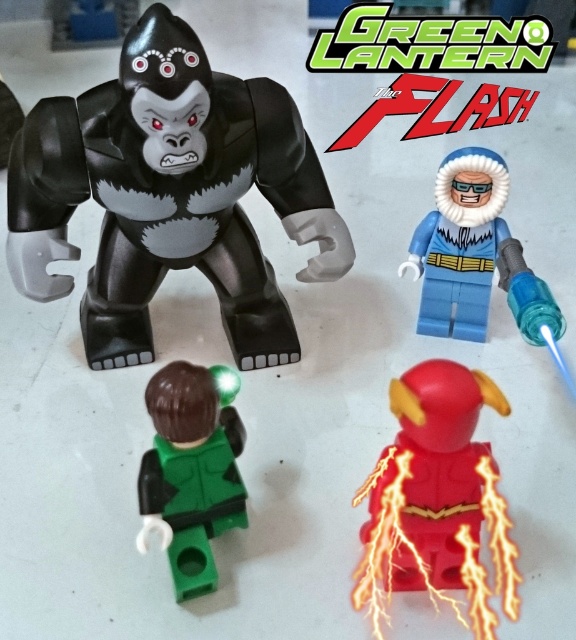
You are a LEGO enthusiast examining the scene. You notice a point marked at coordinates (169, 195). Which LEGO minifigure is located at this point?

The point at (169, 195) marks the location of the matte black gorilla at upper left.